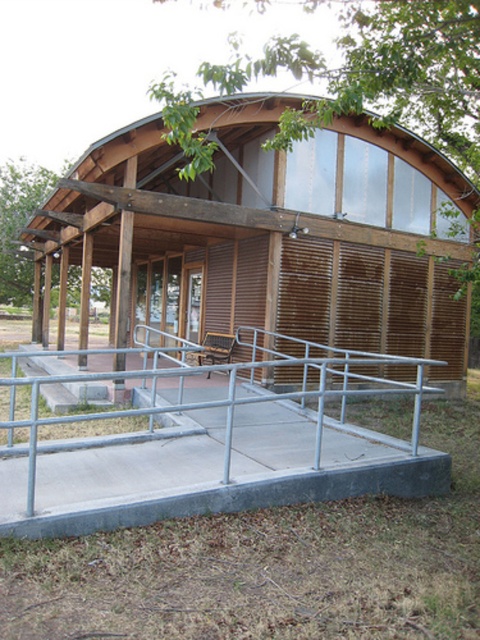
You are a maintenance worker checking the accessibility ramp. You need to ensure that the wooden hut at center does not block the view of the entrance from the silver metallic rail at center. Based on their heights, is this possible?

The wooden hut at center is taller than the silver metallic rail at center, so it may block the view of the entrance from the silver metallic rail at center.

You are standing at the entrance of the wooden pavilion and want to reach the point marked as point (456,374). There is a ramp leading up to the entrance. Which direction should you move relative to point (116,515) to reach your destination?

You should move behind point (116,515) to reach point (456,374) because point (456,374) is located behind point (116,515).